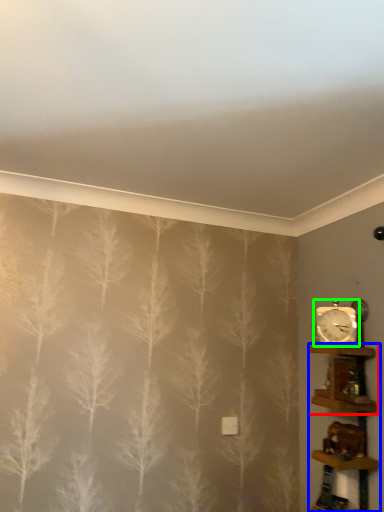
Question: Considering the real-world distances, which object is closest to shelf (highlighted by a red box)? shelf (highlighted by a blue box) or clock (highlighted by a green box).

Choices:
 (A) shelf
 (B) clock

Answer: (A)